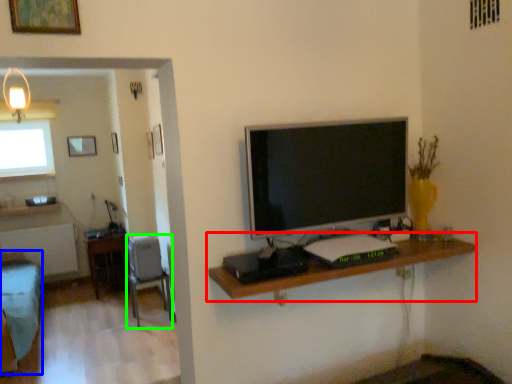
Question: Which is nearer to the shelf (highlighted by a red box)? furniture (highlighted by a blue box) or chair (highlighted by a green box).

Choices:
 (A) furniture
 (B) chair

Answer: (B)